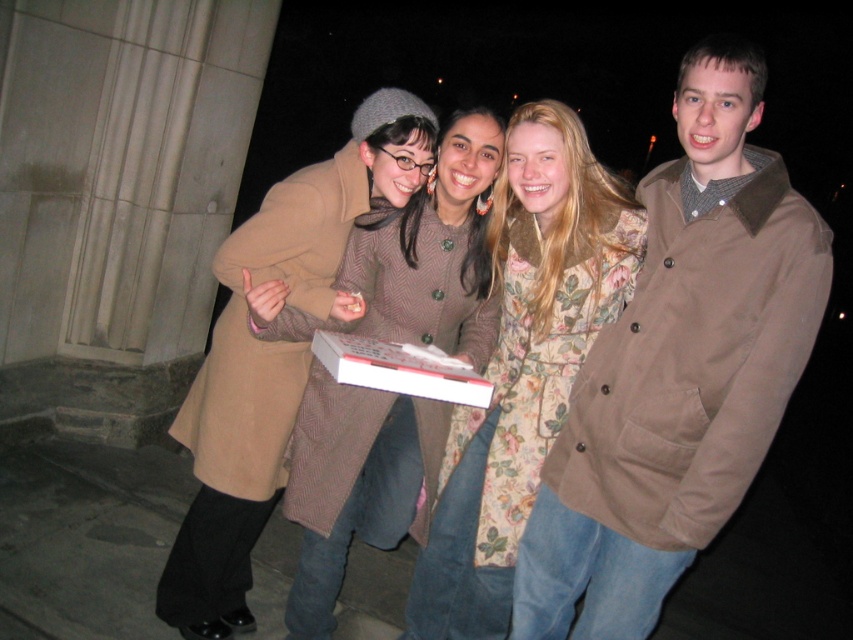
You are standing in front of the group of four people in the image. You want to take a photo of the two points mentioned. Which point, point (x=693, y=76) or point (x=364, y=492), is closer to you?

Point (x=693, y=76) is closer to you than point (x=364, y=492).

You are a photographer at the scene. You need to adjust the lighting so that both the brown cotton jacket at right and the brown wool coat at center are equally illuminated. Which object should you move closer to the light source?

The brown cotton jacket at right is below brown wool coat at center, so you should move the brown cotton jacket at right closer to the light source to ensure both are equally illuminated.